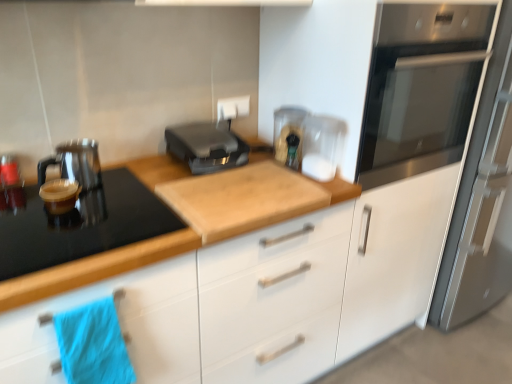
Question: Is wooden cutting board at center looking in the opposite direction of stainless steel oven at upper right?

Choices:
 (A) no
 (B) yes

Answer: (A)

Question: From a real-world perspective, is wooden cutting board at center positioned under stainless steel oven at upper right based on gravity?

Choices:
 (A) no
 (B) yes

Answer: (B)

Question: Is wooden cutting board at center outside of stainless steel oven at upper right?

Choices:
 (A) no
 (B) yes

Answer: (B)

Question: Is the depth of wooden cutting board at center greater than that of stainless steel oven at upper right?

Choices:
 (A) yes
 (B) no

Answer: (B)

Question: From the image's perspective, is wooden cutting board at center beneath stainless steel oven at upper right?

Choices:
 (A) no
 (B) yes

Answer: (B)

Question: Considering their positions, is wooden cutting board at center located in front of or behind black plastic toaster at center, marked as the 2th kitchen appliance in a left-to-right arrangement?

Choices:
 (A) behind
 (B) front

Answer: (B)

Question: In terms of width, does wooden cutting board at center look wider or thinner when compared to black plastic toaster at center, marked as the 2th kitchen appliance in a left-to-right arrangement?

Choices:
 (A) thin
 (B) wide

Answer: (B)

Question: In the image, is wooden cutting board at center on the left side or the right side of black plastic toaster at center, the 1th kitchen appliance viewed from the right?

Choices:
 (A) right
 (B) left

Answer: (B)

Question: From their relative heights in the image, would you say wooden cutting board at center is taller or shorter than black plastic toaster at center, marked as the 2th kitchen appliance in a left-to-right arrangement?

Choices:
 (A) tall
 (B) short

Answer: (A)

Question: From a real-world perspective, is matte black kettle at left, the 1th kitchen appliance when ordered from left to right, physically located above or below black plastic toaster at center, the 1th kitchen appliance viewed from the right?

Choices:
 (A) above
 (B) below

Answer: (B)

Question: Based on their positions, is matte black kettle at left, the 1th kitchen appliance when ordered from left to right, located to the left or right of black plastic toaster at center, marked as the 2th kitchen appliance in a left-to-right arrangement?

Choices:
 (A) left
 (B) right

Answer: (A)

Question: In the image, is matte black kettle at left, the 1th kitchen appliance when ordered from left to right, positioned in front of or behind black plastic toaster at center, the 1th kitchen appliance viewed from the right?

Choices:
 (A) behind
 (B) front

Answer: (B)

Question: From the image's perspective, is matte black kettle at left, the 1th kitchen appliance when ordered from left to right, positioned above or below black plastic toaster at center, marked as the 2th kitchen appliance in a left-to-right arrangement?

Choices:
 (A) above
 (B) below

Answer: (B)

Question: Is stainless steel fridge at right bigger or smaller than wooden cutting board at center?

Choices:
 (A) small
 (B) big

Answer: (A)

Question: From the image's perspective, is stainless steel fridge at right positioned above or below wooden cutting board at center?

Choices:
 (A) below
 (B) above

Answer: (B)